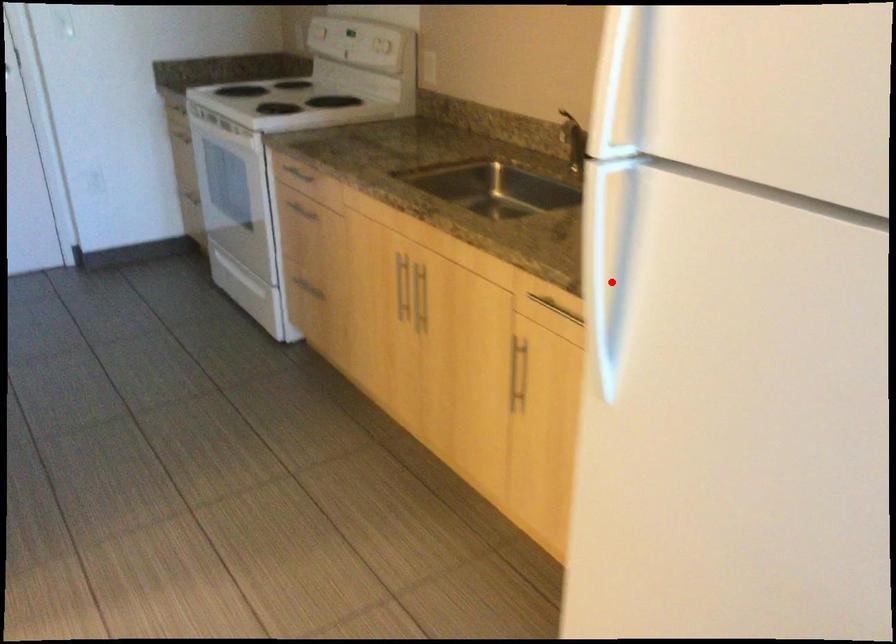
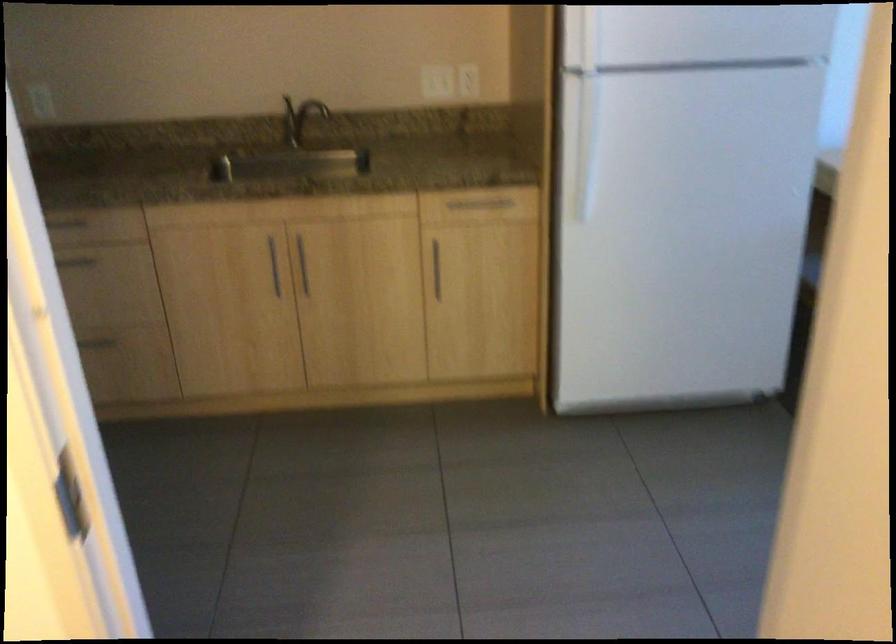
Question: I am providing you with two images of the same scene from different viewpoints. In image1, a red point is highlighted. Considering the same 3D point in image2, which of the following is correct?

Choices:
 (A) It is closer
 (B) It is farther

Answer: (B)